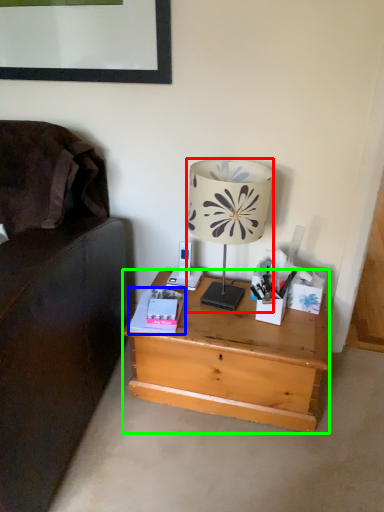
Question: Which object is positioned farthest from lamp (highlighted by a red box)? Select from paperback book (highlighted by a blue box) and desk (highlighted by a green box).

Choices:
 (A) paperback book
 (B) desk

Answer: (B)